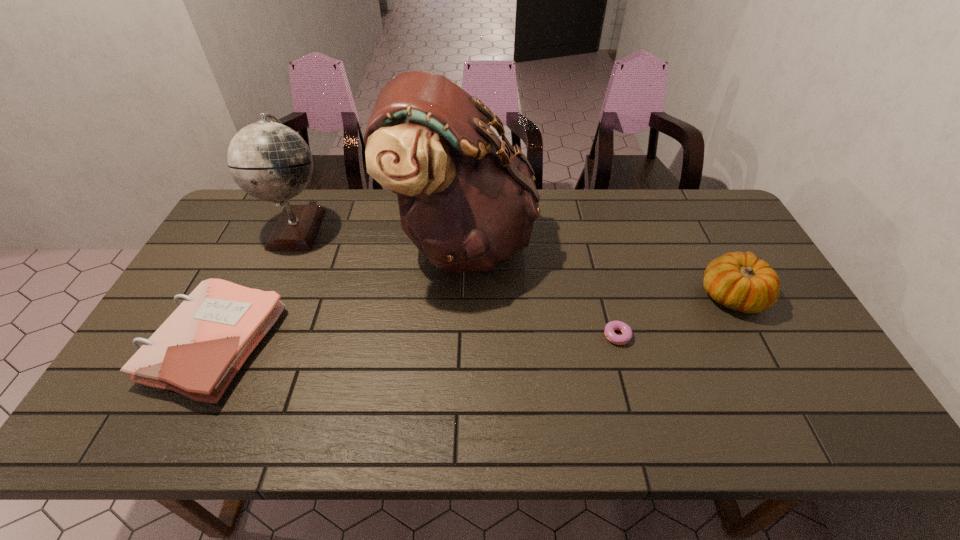
This screenshot has height=540, width=960. Identify the location of free space located 0.200m on the front of the third shortest object. (780, 388).

The width and height of the screenshot is (960, 540). In order to click on vacant space located on the right of the phonebook in this screenshot , I will do `click(430, 345)`.

Where is `vacant area situated 0.090m on the left of the second object from right to left`? vacant area situated 0.090m on the left of the second object from right to left is located at coordinates (569, 336).

Image resolution: width=960 pixels, height=540 pixels. Find the location of `satchel that is at the far edge`. satchel that is at the far edge is located at coordinates (467, 200).

Find the location of a particular element. globe present at the far edge is located at coordinates (268, 160).

This screenshot has height=540, width=960. I want to click on object that is at the near edge, so click(198, 350).

Where is `globe that is at the left edge`? The width and height of the screenshot is (960, 540). globe that is at the left edge is located at coordinates (268, 160).

At what (x,y) coordinates should I click in order to perform the action: click on phonebook situated at the left edge. Please return your answer as a coordinate pair (x, y). The image size is (960, 540). Looking at the image, I should click on (198, 350).

At what (x,y) coordinates should I click in order to perform the action: click on object present at the right edge. Please return your answer as a coordinate pair (x, y). This screenshot has height=540, width=960. Looking at the image, I should click on (739, 281).

Identify the location of object located in the far left corner section of the desktop. Image resolution: width=960 pixels, height=540 pixels. (268, 160).